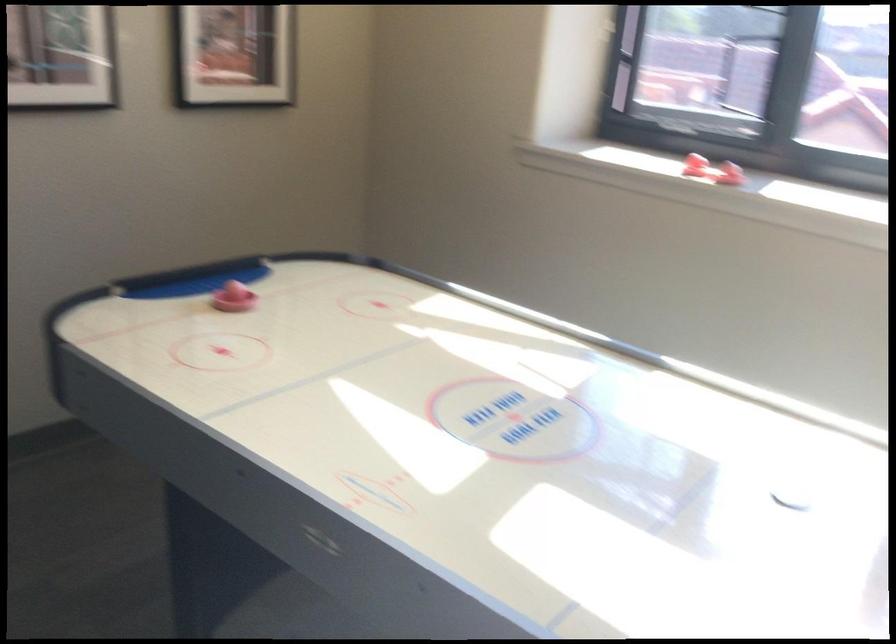
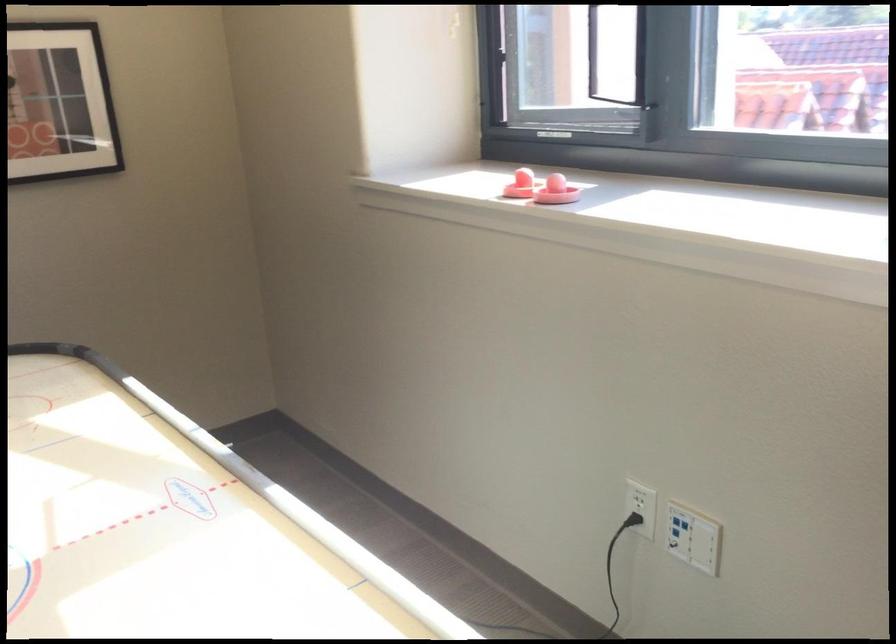
In the second image, find the point that corresponds to (685,166) in the first image.

(521, 185)